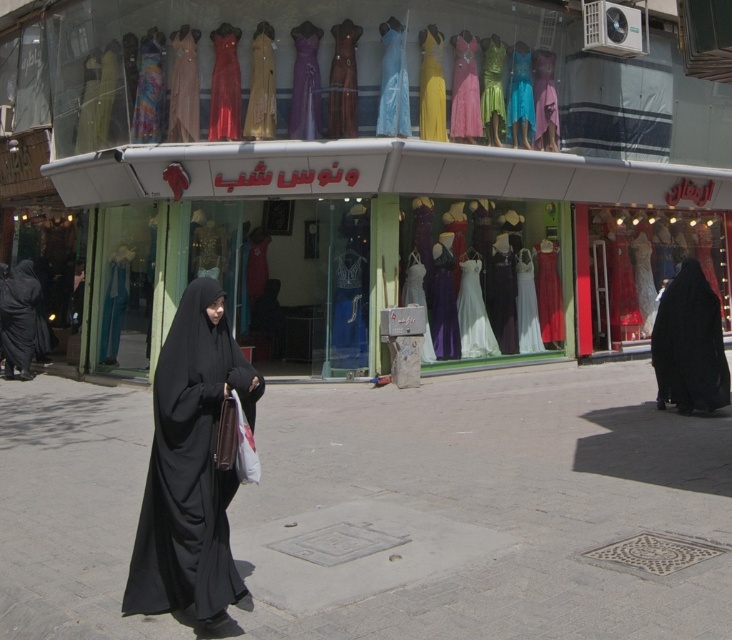
You are a customer standing in front of the clothing store window. You see the yellow satin dress at center and the matte blue dress at center. Which dress is closer to you?

The yellow satin dress at center is closer to you because it is in front of the matte blue dress at center.

You are a customer looking at the dresses displayed in the store window. You see the white satin dress at center and the green satin dress at center. Which dress is closer to you?

The white satin dress at center is closer to you because it is positioned further to the viewer than the green satin dress at center.